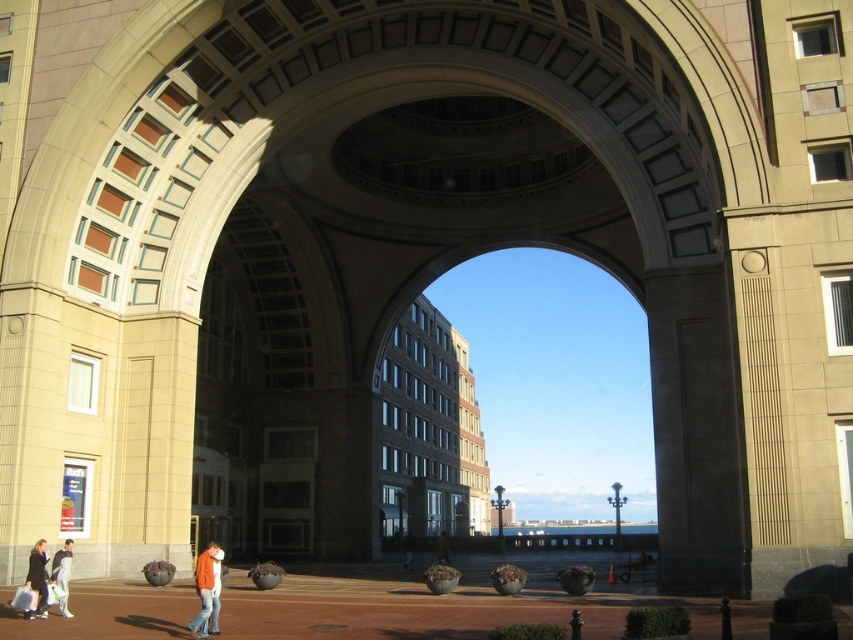
Looking at this image, can you confirm if black leather jacket at lower left is thinner than dark gray jacket at center?

Incorrect, black leather jacket at lower left's width is not less than dark gray jacket at center's.

Is point (41, 584) closer to camera compared to point (408, 552)?

Yes, point (41, 584) is closer to viewer.

Identify the location of black leather jacket at lower left. The image size is (853, 640). (38, 579).

Does point (215, 554) come behind point (447, 547)?

No, it is not.

Does orange cotton jacket at lower left appear on the right side of dark brown leather jacket at center?

In fact, orange cotton jacket at lower left is to the left of dark brown leather jacket at center.

Which is behind, point (210, 561) or point (450, 563)?

The point (450, 563) is more distant.

I want to click on orange cotton jacket at lower left, so click(207, 589).

Who is lower down, light brown leather jacket at lower left or dark gray jacket at center?

dark gray jacket at center

This screenshot has width=853, height=640. What do you see at coordinates (62, 573) in the screenshot? I see `light brown leather jacket at lower left` at bounding box center [62, 573].

Between point (62, 616) and point (408, 570), which one is positioned in front?

Point (62, 616) is more forward.

Find the location of a particular element. light brown leather jacket at lower left is located at coordinates (62, 573).